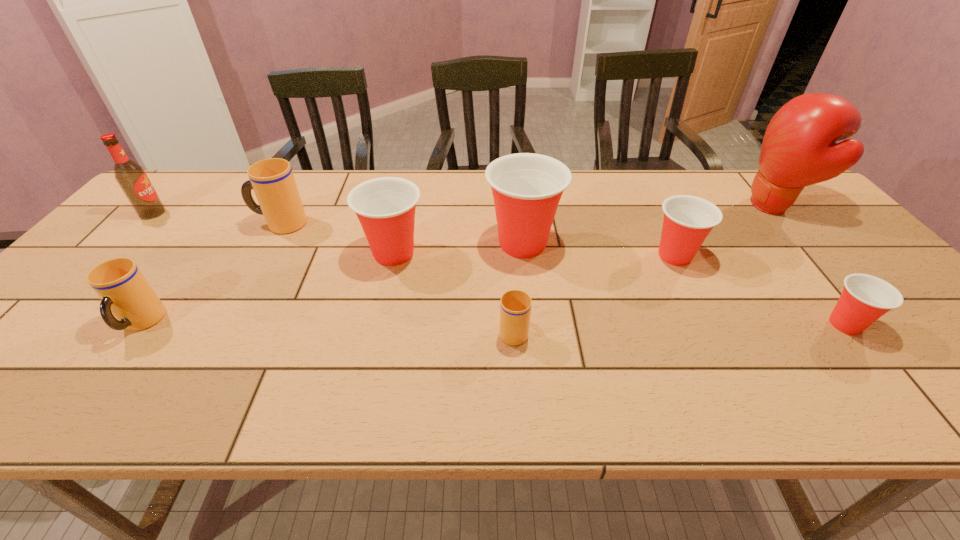
What are the coordinates of `blank region between the smallest red cup and the eighth object from right to left` in the screenshot? It's located at 493,324.

The image size is (960, 540). In order to click on unoccupied area between the leftmost red cup and the red boxing glove in this screenshot , I will do `click(584, 230)`.

Identify which object is located as the nearest to the red boxing glove. Please provide its 2D coordinates. Your answer should be formatted as a tuple, i.e. [(x, y)], where the tuple contains the x and y coordinates of a point satisfying the conditions above.

[(688, 220)]

Identify which object is the eighth closest to the leftmost object. Please provide its 2D coordinates. Your answer should be formatted as a tuple, i.e. [(x, y)], where the tuple contains the x and y coordinates of a point satisfying the conditions above.

[(865, 298)]

Locate which cup ranks second in proximity to the second biggest red cup. Please provide its 2D coordinates. Your answer should be formatted as a tuple, i.e. [(x, y)], where the tuple contains the x and y coordinates of a point satisfying the conditions above.

[(272, 180)]

Identify which cup is located as the nearest to the smallest beige cup. Please provide its 2D coordinates. Your answer should be formatted as a tuple, i.e. [(x, y)], where the tuple contains the x and y coordinates of a point satisfying the conditions above.

[(526, 187)]

Identify the location of the closest red cup to the nearest red cup. (688, 220).

Locate an element on the screen. This screenshot has height=540, width=960. red cup that stands as the second closest to the second smallest beige cup is located at coordinates (526, 187).

Locate which beige cup is the closest to the rightmost beige cup. Please provide its 2D coordinates. Your answer should be formatted as a tuple, i.e. [(x, y)], where the tuple contains the x and y coordinates of a point satisfying the conditions above.

[(272, 180)]

Locate an element on the screen. beige cup that stands as the third closest to the third red cup from right to left is located at coordinates click(x=125, y=292).